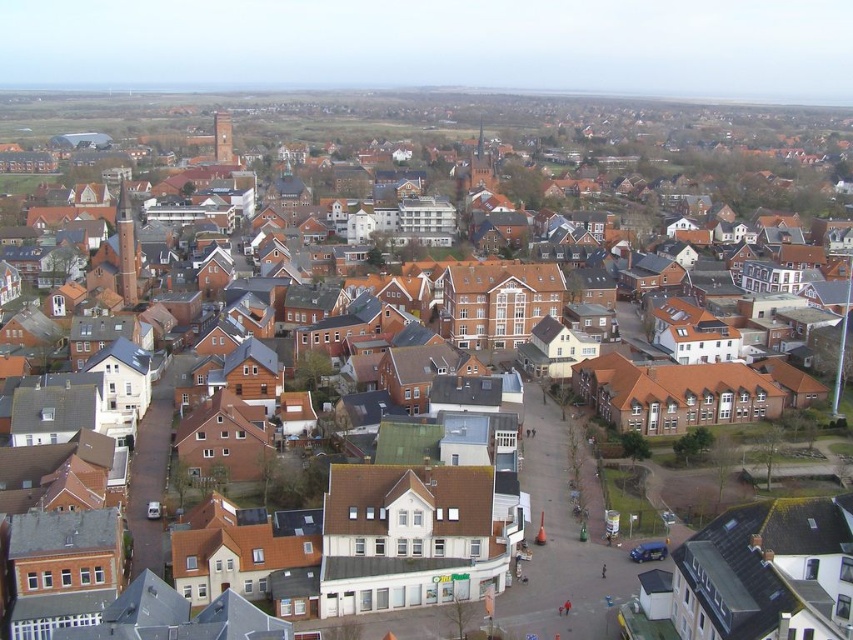
Question: Is light brown wooden tower at center-left bigger than brick tower at upper left?

Choices:
 (A) yes
 (B) no

Answer: (A)

Question: Among these objects, which one is farthest from the camera?

Choices:
 (A) light brown wooden tower at center-left
 (B) brick tower at upper left

Answer: (B)

Question: Does light brown wooden tower at center-left appear on the left side of brick tower at upper left?

Choices:
 (A) no
 (B) yes

Answer: (A)

Question: Which object is farther from the camera taking this photo?

Choices:
 (A) light brown wooden tower at center-left
 (B) brick tower at upper left

Answer: (B)

Question: Can you confirm if light brown wooden tower at center-left is smaller than brick tower at upper left?

Choices:
 (A) no
 (B) yes

Answer: (A)

Question: Which point is farther to the camera?

Choices:
 (A) brick tower at upper left
 (B) light brown wooden tower at center-left

Answer: (A)